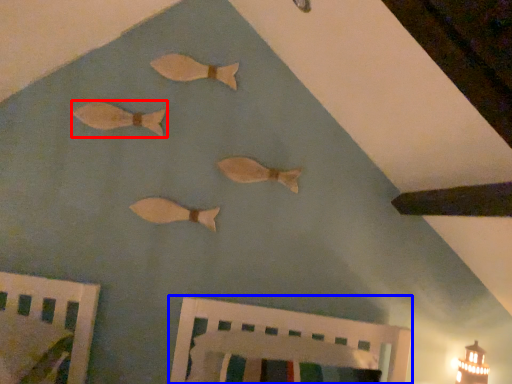
Question: Which object appears closest to the camera in this image, fish (highlighted by a red box) or furniture (highlighted by a blue box)?

Choices:
 (A) fish
 (B) furniture

Answer: (B)